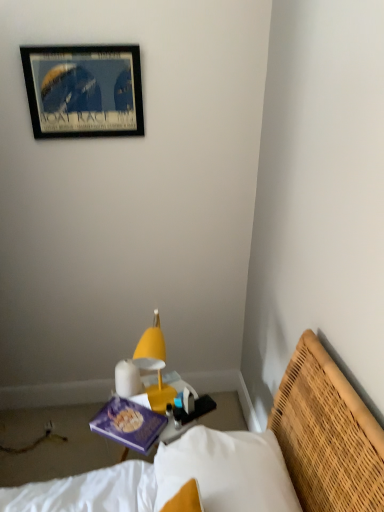
You are a GUI agent. You are given a task and a screenshot of the screen. Output one action in this format:
    pyautogui.click(x=<x>, y=<y>)
    Task: Click on the vacant area on top of purple matte book at center (from a real-world perspective)
    
    Given the screenshot: What is the action you would take?
    pyautogui.click(x=127, y=417)